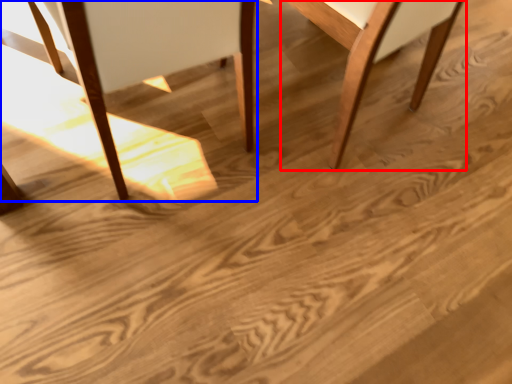
Question: Which of the following is the closest to the observer, chair (highlighted by a red box) or chair (highlighted by a blue box)?

Choices:
 (A) chair
 (B) chair

Answer: (B)